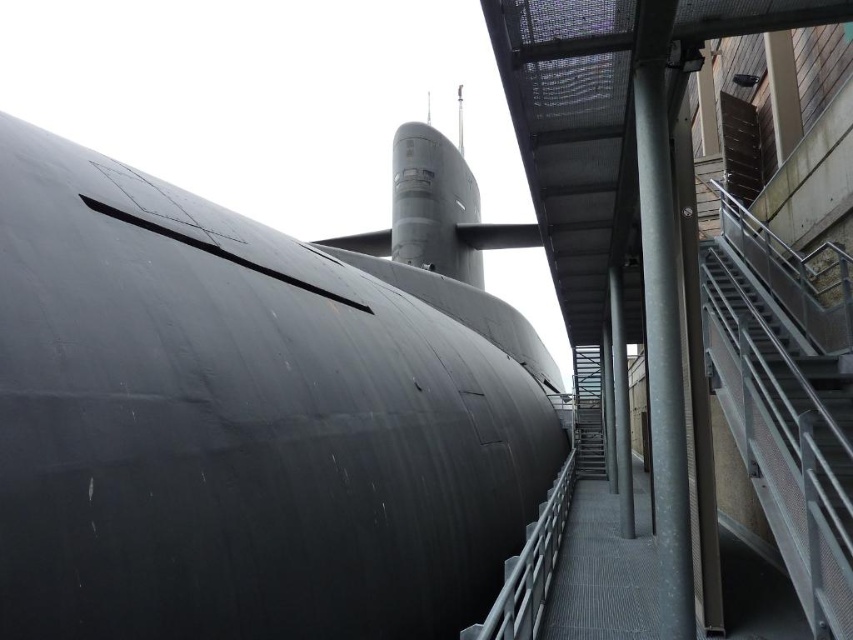
Question: Can you confirm if matte black submarine at center is positioned below metallic gray staircase at right?

Choices:
 (A) yes
 (B) no

Answer: (B)

Question: Which point is farther to the camera?

Choices:
 (A) matte black submarine at center
 (B) metallic gray staircase at right

Answer: (B)

Question: Is matte black submarine at center bigger than metallic gray staircase at right?

Choices:
 (A) no
 (B) yes

Answer: (B)

Question: Observing the image, what is the correct spatial positioning of matte black submarine at center in reference to metallic gray staircase at right?

Choices:
 (A) below
 (B) above

Answer: (B)